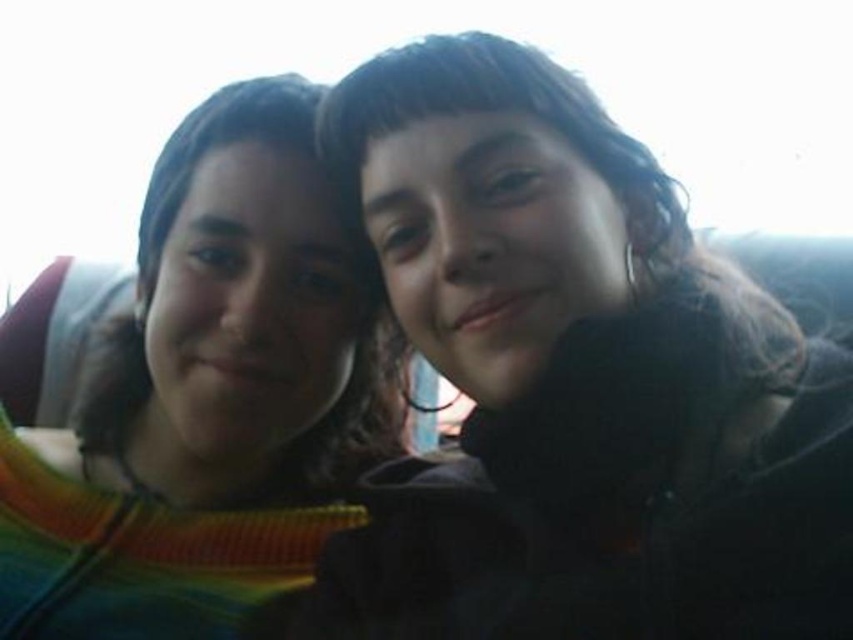
Does matte black jacket at center have a larger size compared to rainbow striped sweater at left?

Actually, matte black jacket at center might be smaller than rainbow striped sweater at left.

Between point (502, 49) and point (380, 429), which one is positioned in front?

Point (502, 49) is more forward.

Identify the location of matte black jacket at center. The image size is (853, 640). (576, 381).